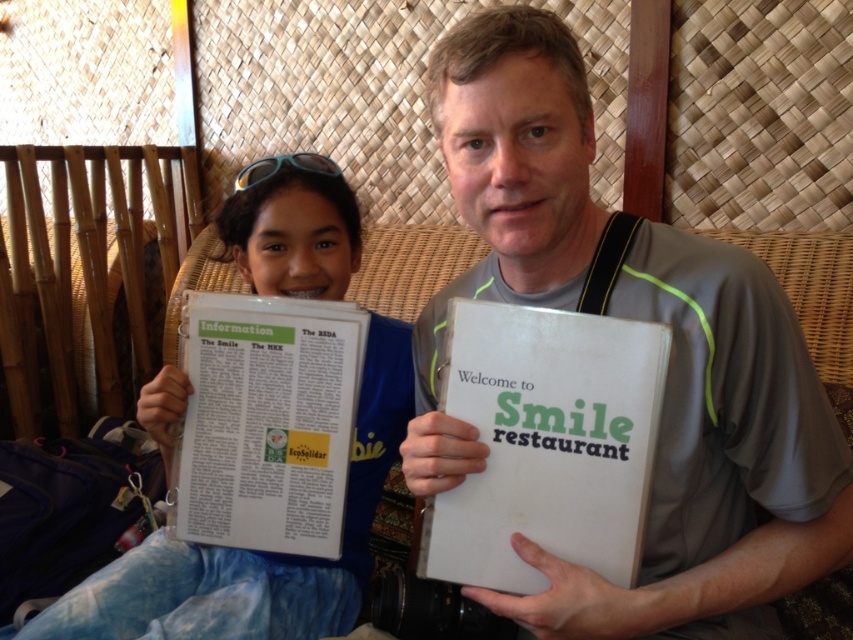
Question: Is white paper at center thinner than blue tie-dye pants at lower left?

Choices:
 (A) yes
 (B) no

Answer: (A)

Question: Is white paper menu at center to the right of blue tie-dye pants at lower left from the viewer's perspective?

Choices:
 (A) yes
 (B) no

Answer: (A)

Question: Which of the following is the farthest from the observer?

Choices:
 (A) white paper menu at center
 (B) blue tie-dye pants at lower left
 (C) white paper information sheet at center

Answer: (C)

Question: Does white paper menu at center have a greater width compared to white paper information sheet at center?

Choices:
 (A) yes
 (B) no

Answer: (A)

Question: Which point is farther from the camera taking this photo?

Choices:
 (A) (277, 380)
 (B) (219, 630)
 (C) (734, 264)

Answer: (A)

Question: Which of the following is the closest to the observer?

Choices:
 (A) (727, 316)
 (B) (509, 445)
 (C) (155, 440)

Answer: (B)